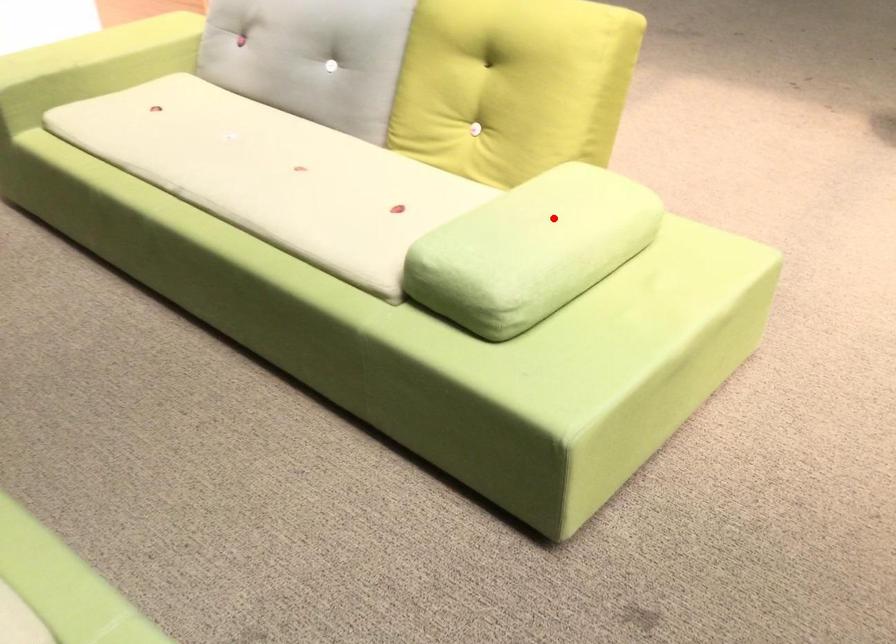
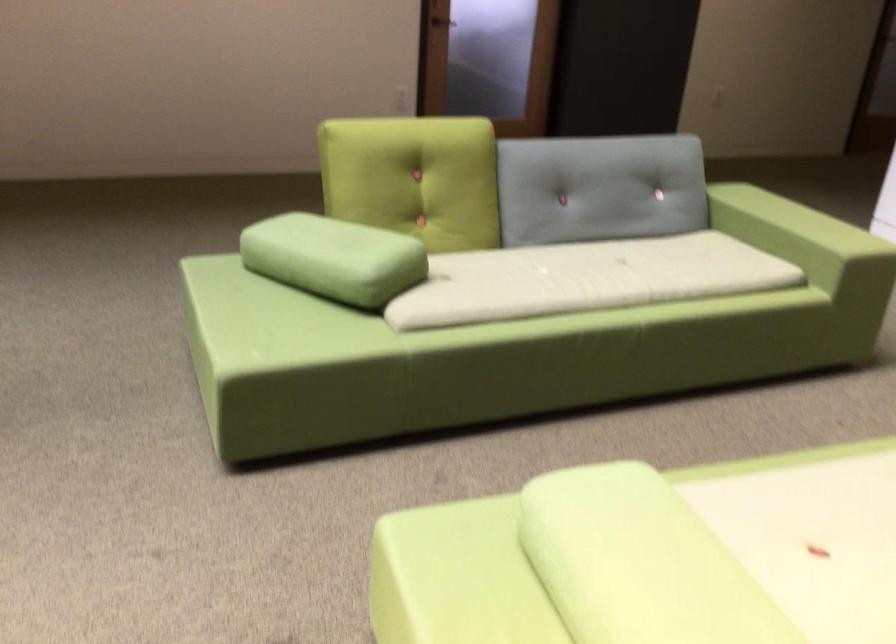
The point at the highlighted location is marked in the first image. Where is the corresponding point in the second image?

(639, 563)